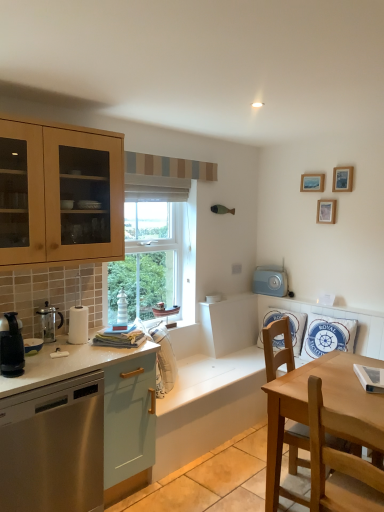
At what (x,y) coordinates should I click in order to perform the action: click on blank space above stainless steel dishwasher at left (from a real-world perspective). Please return your answer as a coordinate pair (x, y). Image resolution: width=384 pixels, height=512 pixels. Looking at the image, I should click on (45, 361).